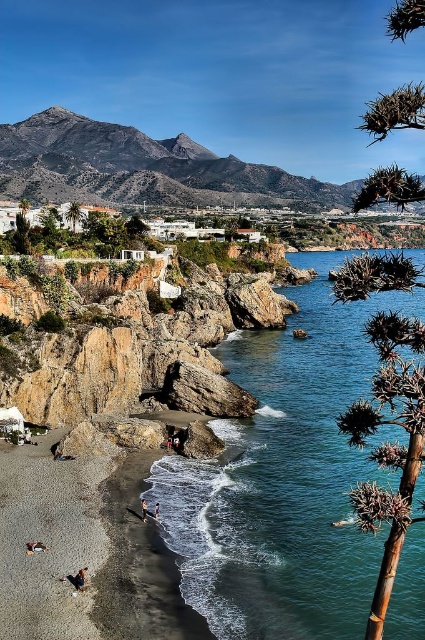
Question: Which object is the closest to the dark brown sand at lower left?

Choices:
 (A) purple spiky plant at right
 (B) brown leather sandal at lower left
 (C) dark blue jeans at lower center

Answer: (C)

Question: In this image, where is green leafy tree at upper left located relative to green leafy tree at center?

Choices:
 (A) below
 (B) above

Answer: (A)

Question: Can you confirm if green leafy tree at center is wider than smooth sand person at lower left?

Choices:
 (A) yes
 (B) no

Answer: (A)

Question: Which point is farther to the camera?

Choices:
 (A) purple spiky plant at right
 (B) dark brown sand at lower left

Answer: (B)

Question: Is rugged brown rock formation at upper center further to camera compared to purple spiky plant at right?

Choices:
 (A) no
 (B) yes

Answer: (B)

Question: Which of the following is the farthest from the observer?

Choices:
 (A) clear blue water at lower left
 (B) green spiky bush at upper right

Answer: (A)